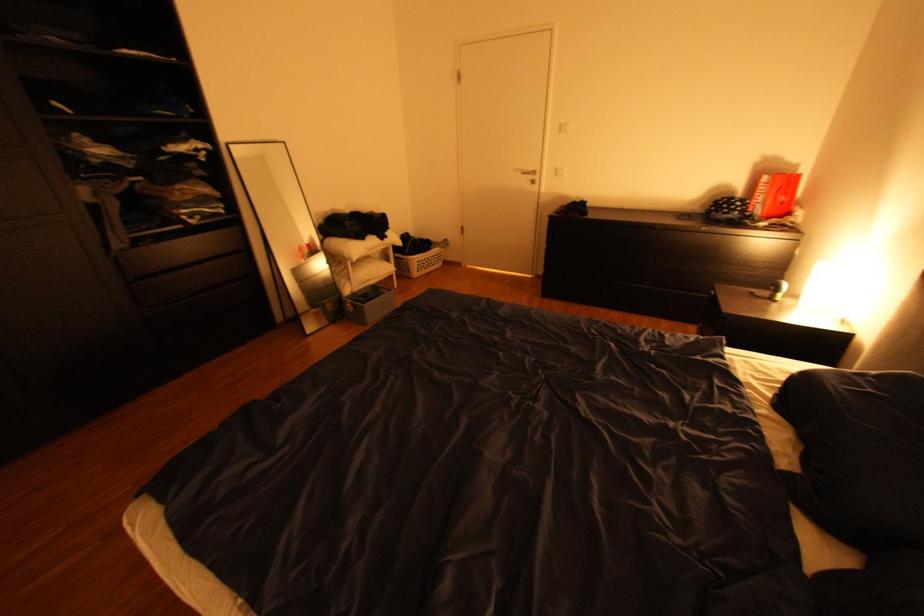
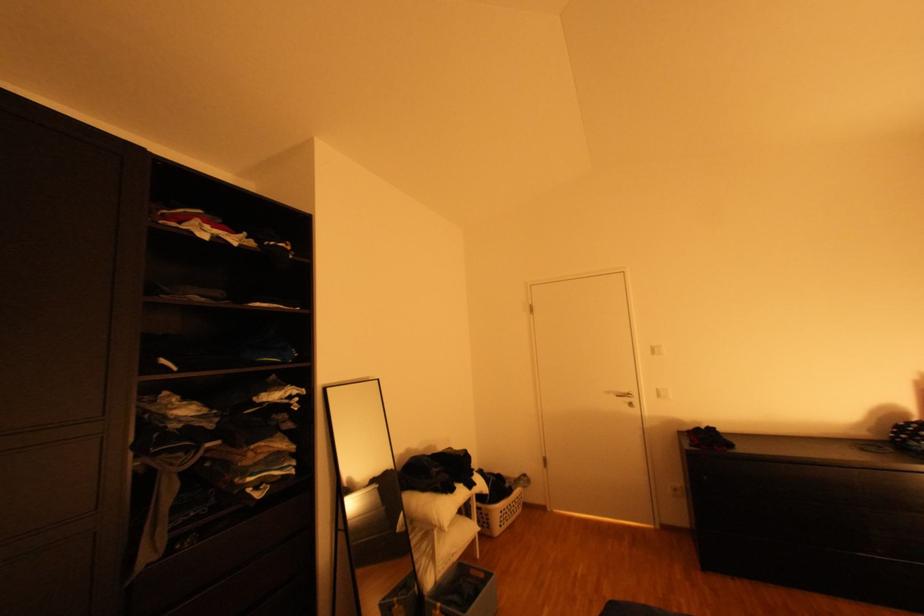
The point at (526,171) is marked in the first image. Where is the corresponding point in the second image?

(617, 392)